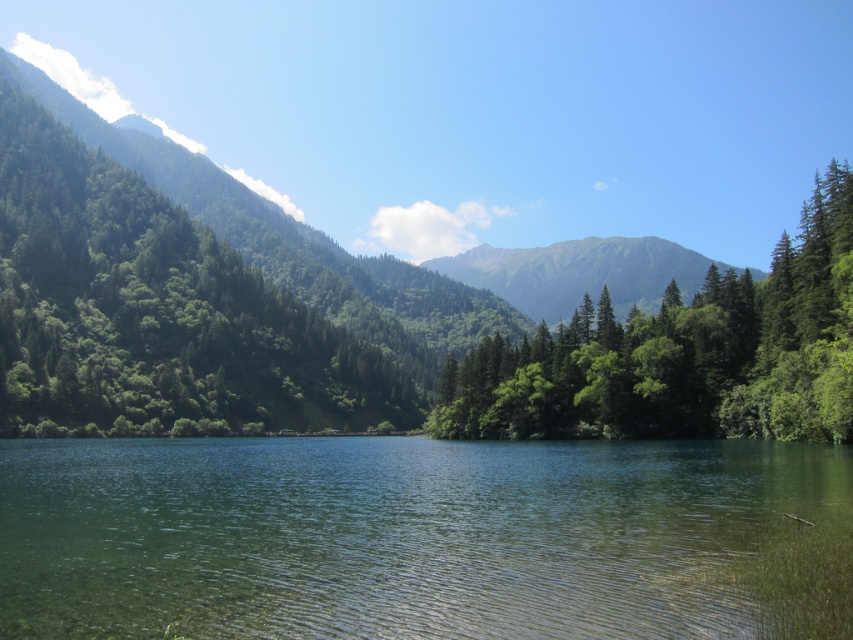
You are a hiker who wants to cross from the green leafy trees at left to the clear water at center. Can you walk directly between them without needing to go around?

The clear water at center and green leafy trees at left are 117.03 meters apart, so you can walk directly between them without needing to go around.

You are a hiker standing at the edge of the lake looking towards the center of the image. You see the green matte tree at center and the green grassy mountain at center. Which object appears narrower from your perspective?

The green matte tree at center appears narrower than the green grassy mountain at center from your perspective.